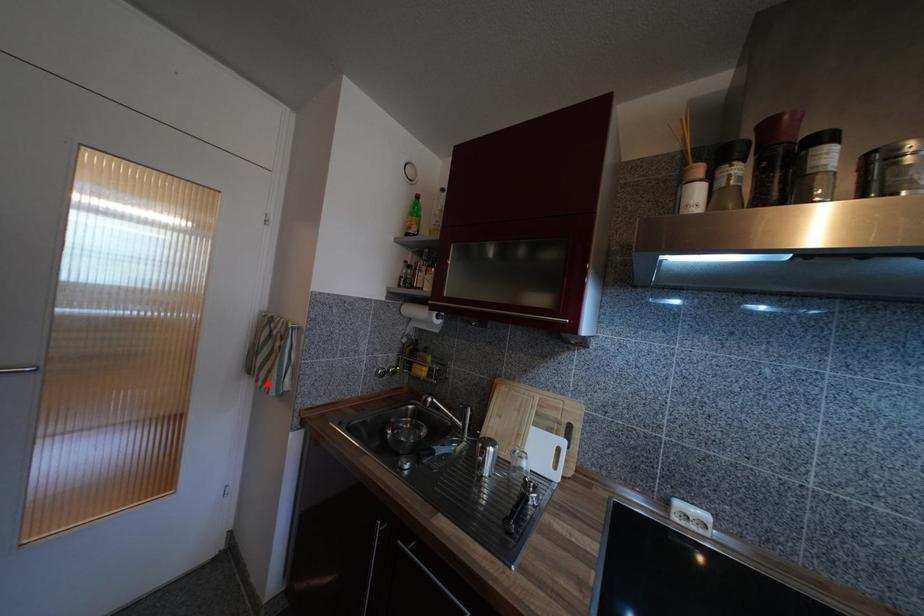
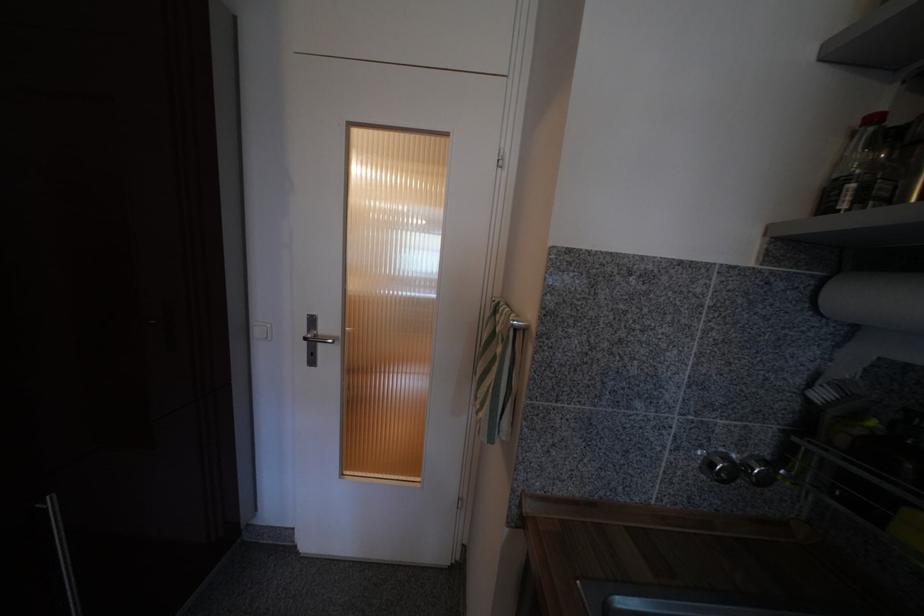
The point at the highlighted location is marked in the first image. Where is the corresponding point in the second image?

(485, 407)